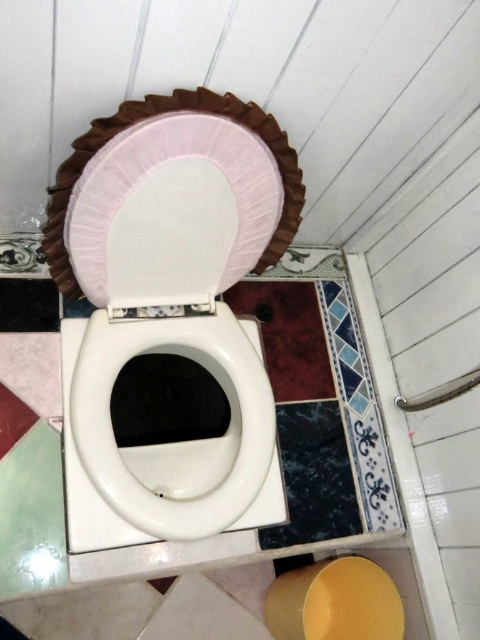
You are a bathroom designer assessing the bathroom layout. You need to ensure that the white glossy toilet bowl at center is not obstructed by the pink fabric toilet seat cover at center. Based on their sizes, is this possible?

The white glossy toilet bowl at center is much taller than the pink fabric toilet seat cover at center, so it is possible to position them without obstruction as the toilet bowl rises higher.

You are a bathroom designer planning to install a new grab bar. The current grab bar is positioned to the right of the white glossy toilet bowl at center. If you want to place the new grab bar directly above the toilet bowl, where should you position it relative to the existing grab bar?

The new grab bar should be positioned to the left of the existing grab bar to place it directly above the white glossy toilet bowl at center.